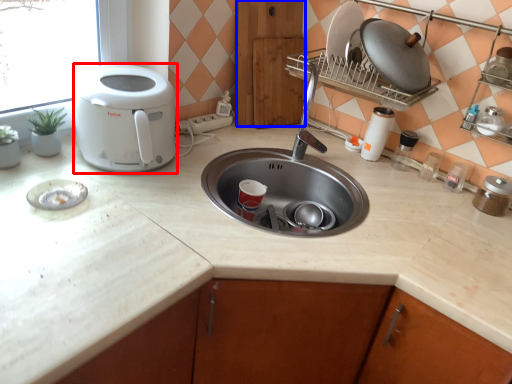
Question: Which object appears closest to the camera in this image, home appliance (highlighted by a red box) or cabinetry (highlighted by a blue box)?

Choices:
 (A) home appliance
 (B) cabinetry

Answer: (A)